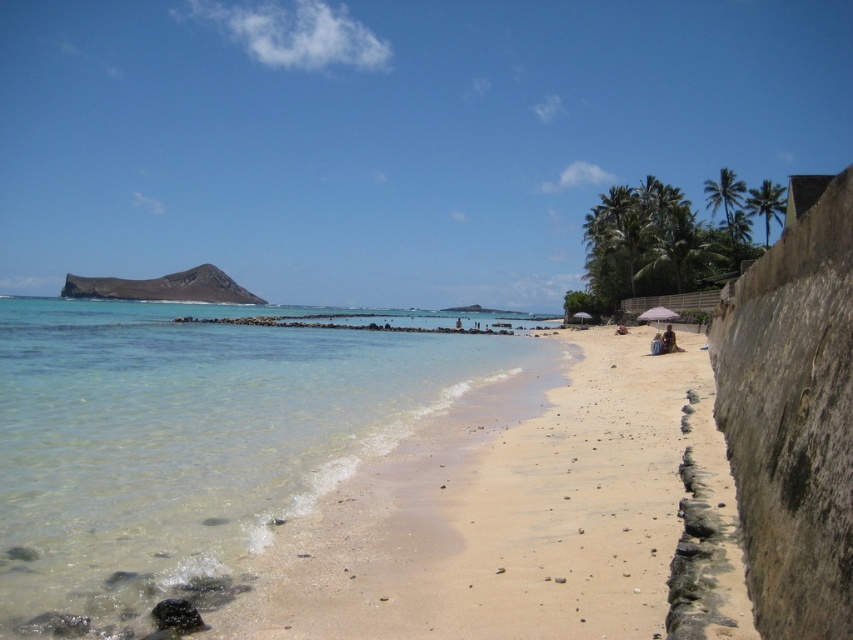
Question: Which object appears farthest from the camera in this image?

Choices:
 (A) sandy beach at lower right
 (B) beige sand at beach center
 (C) clear water at lower left

Answer: (B)

Question: Is clear water at lower left thinner than beige sand at beach center?

Choices:
 (A) no
 (B) yes

Answer: (A)

Question: Estimate the real-world distances between objects in this image. Which object is closer to the clear water at lower left?

Choices:
 (A) beige sand at beach center
 (B) blue denim shorts at lower right
 (C) sandy beach at lower right

Answer: (C)

Question: Can you confirm if sandy beach at lower right is smaller than blue denim shorts at lower right?

Choices:
 (A) no
 (B) yes

Answer: (A)

Question: Which is farther from the clear water at lower left?

Choices:
 (A) purple fabric umbrella at lower right
 (B) sandy beach at lower right
 (C) blue denim shorts at lower right
 (D) beige sand at beach center

Answer: (D)

Question: Is beige sand at beach center positioned in front of blue denim shorts at lower right?

Choices:
 (A) no
 (B) yes

Answer: (B)